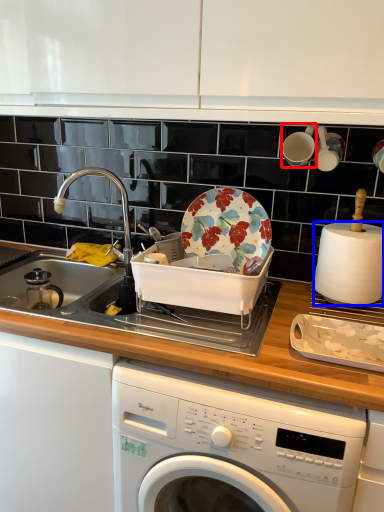
Question: Which of the following is the closest to the observer, tableware (highlighted by a red box) or paper towel (highlighted by a blue box)?

Choices:
 (A) tableware
 (B) paper towel

Answer: (B)